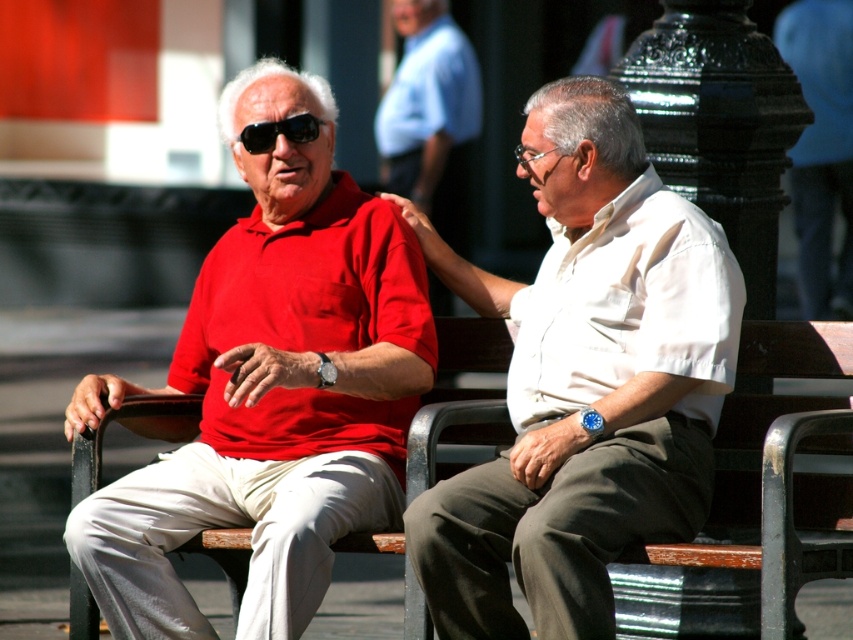
Question: Which point is farther to the camera?

Choices:
 (A) brown wooden bench at center
 (B) matte red shirt at center
 (C) black matte sunglasses at upper left

Answer: (B)

Question: Is matte red polo shirt at left bigger than matte red shirt at center?

Choices:
 (A) no
 (B) yes

Answer: (B)

Question: Which object appears farthest from the camera in this image?

Choices:
 (A) matte red shirt at center
 (B) black matte sunglasses at upper left

Answer: (A)

Question: Can you confirm if matte red polo shirt at left is positioned to the right of white matte shirt at center?

Choices:
 (A) no
 (B) yes

Answer: (A)

Question: Which object is closer to the camera taking this photo?

Choices:
 (A) black matte sunglasses at upper left
 (B) matte red polo shirt at left
 (C) white matte shirt at center
 (D) brown wooden bench at center

Answer: (C)

Question: Does white matte shirt at center have a lesser width compared to brown wooden bench at center?

Choices:
 (A) no
 (B) yes

Answer: (A)